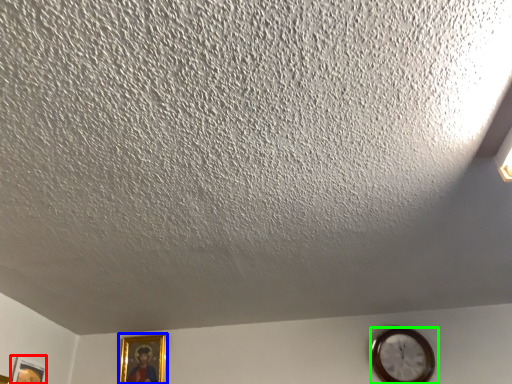
Question: Which object is the farthest from picture frame (highlighted by a red box)? Choose among these: picture frame (highlighted by a blue box) or wall clock (highlighted by a green box).

Choices:
 (A) picture frame
 (B) wall clock

Answer: (B)